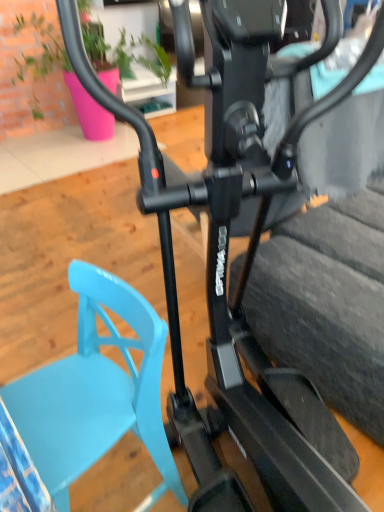
Question: Considering their positions, is matte green plant at upper center located in front of or behind black rubber tire at center?

Choices:
 (A) front
 (B) behind

Answer: (B)

Question: From a real-world perspective, relative to black rubber tire at center, is matte green plant at upper center vertically above or below?

Choices:
 (A) above
 (B) below

Answer: (A)

Question: Which object is positioned farthest from the light blue plastic swivel chair at lower left?

Choices:
 (A) matte green plant at upper center
 (B) black rubber tire at center

Answer: (A)

Question: Based on their relative distances, which object is nearer to the black rubber tire at center?

Choices:
 (A) light blue plastic swivel chair at lower left
 (B) matte green plant at upper center

Answer: (A)